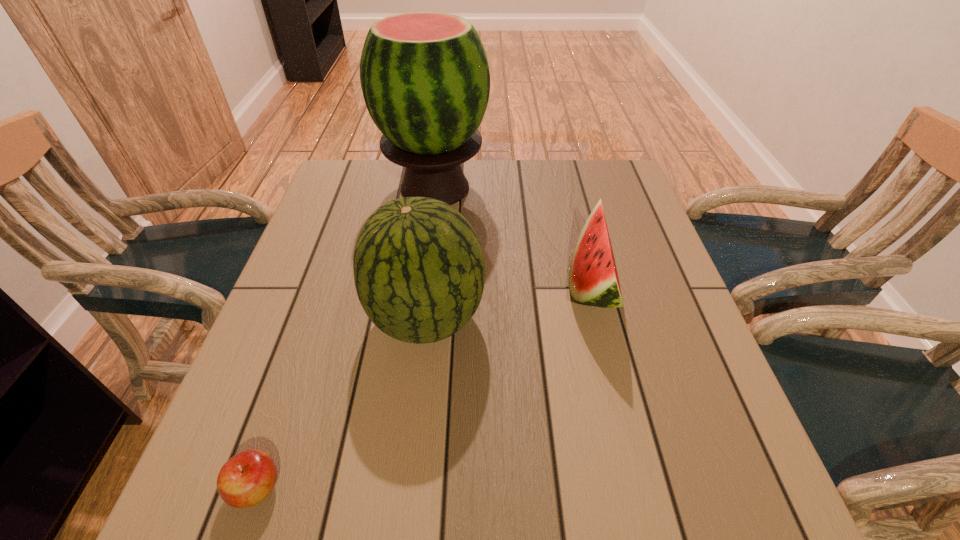
Locate an element on the screen. the tallest object is located at coordinates (425, 79).

In order to click on the tallest watermelon in this screenshot , I will do `click(425, 79)`.

Locate an element on the screen. the second tallest object is located at coordinates (419, 270).

Where is `the third tallest object`? The image size is (960, 540). the third tallest object is located at coordinates (593, 279).

Find the location of a particular element. the rightmost object is located at coordinates (593, 279).

Where is `the leftmost object`? This screenshot has width=960, height=540. the leftmost object is located at coordinates (246, 479).

You are a GUI agent. You are given a task and a screenshot of the screen. Output one action in this format:
    pyautogui.click(x=<x>, y=<y>)
    Task: Click on the nearest object
    This screenshot has width=960, height=540.
    Given the screenshot: What is the action you would take?
    pyautogui.click(x=246, y=479)

The height and width of the screenshot is (540, 960). What are the coordinates of `vacant space located 0.280m on the front of the tallest watermelon` in the screenshot? It's located at (420, 299).

Locate an element on the screen. The image size is (960, 540). vacant space situated on the right of the third shortest object is located at coordinates (655, 319).

This screenshot has height=540, width=960. I want to click on vacant region located on the outer rind of the shortest watermelon, so click(x=452, y=285).